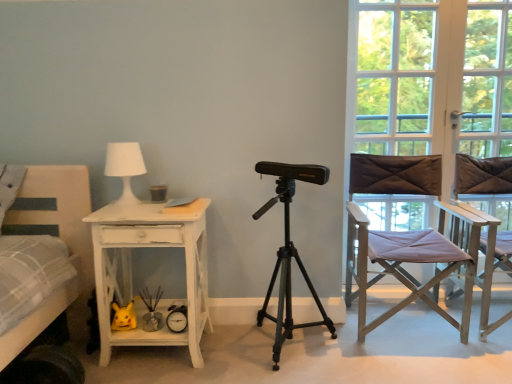
Where is `free region under light brown fabric director's chair at right, the first chair from the left (from a real-world perspective)`? The width and height of the screenshot is (512, 384). free region under light brown fabric director's chair at right, the first chair from the left (from a real-world perspective) is located at coordinates (411, 326).